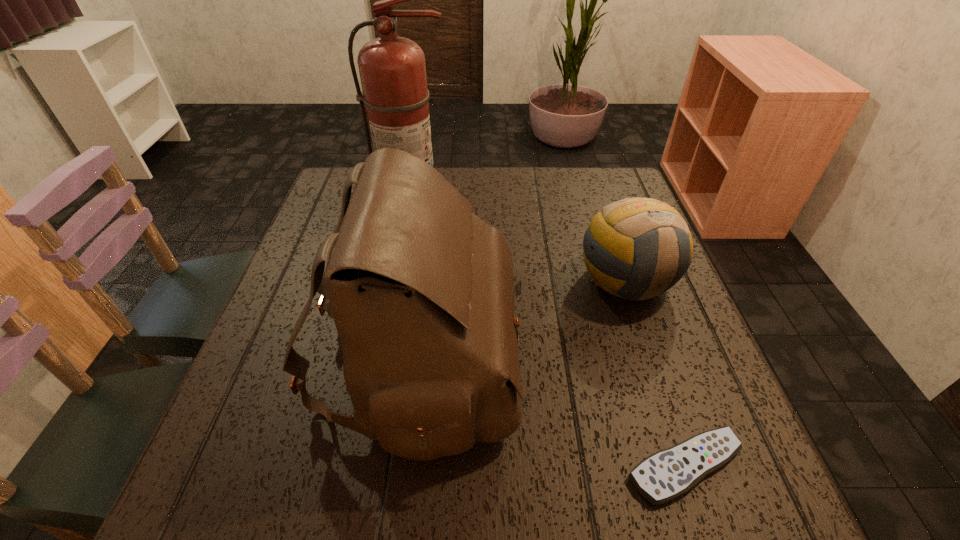
Locate an element on the screen. satchel present at the near edge is located at coordinates (421, 290).

You are a GUI agent. You are given a task and a screenshot of the screen. Output one action in this format:
    pyautogui.click(x=<x>, y=<y>)
    Task: Click on the remote control present at the near edge
    The width and height of the screenshot is (960, 540).
    Given the screenshot: What is the action you would take?
    pyautogui.click(x=668, y=474)

At what (x,y) coordinates should I click in order to perform the action: click on fire extinguisher that is positioned at the left edge. Please return your answer as a coordinate pair (x, y). Looking at the image, I should click on coord(392,69).

In order to click on satchel at the left edge in this screenshot , I will do `click(421, 290)`.

In order to click on volleyball that is at the right edge in this screenshot , I will do `click(637, 248)`.

This screenshot has height=540, width=960. What are the coordinates of `remote control that is at the right edge` in the screenshot? It's located at (668, 474).

Where is `object that is at the far left corner`? object that is at the far left corner is located at coordinates (392, 69).

This screenshot has height=540, width=960. Identify the location of object positioned at the near left corner. (421, 290).

I want to click on object present at the near right corner, so click(668, 474).

In the image, there is a desktop. Identify the location of vacant space at the far edge. This screenshot has height=540, width=960. (559, 180).